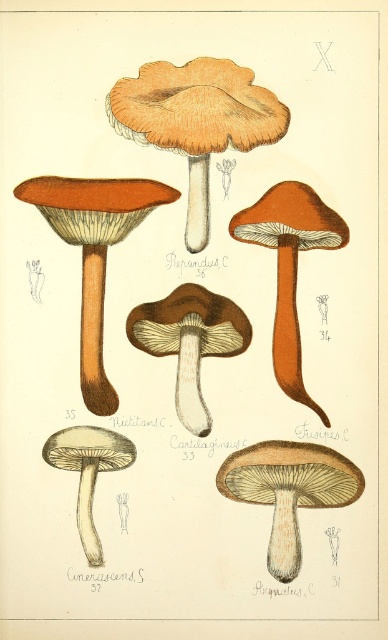
Is matte orange mushroom at left above smooth beige mushroom at lower left?

Correct, matte orange mushroom at left is located above smooth beige mushroom at lower left.

Between point (131, 225) and point (91, 528), which one is positioned in front?

Point (91, 528)

Describe the element at coordinates (93, 252) in the screenshot. This screenshot has height=640, width=388. I see `matte orange mushroom at left` at that location.

At what (x,y) coordinates should I click in order to perform the action: click on matte orange mushroom at left. Please return your answer as a coordinate pair (x, y). Looking at the image, I should click on (93, 252).

Is matte orange mushroom at left to the left of smooth beige mushroom at center from the viewer's perspective?

Yes, matte orange mushroom at left is to the left of smooth beige mushroom at center.

Describe the element at coordinates (93, 252) in the screenshot. I see `matte orange mushroom at left` at that location.

I want to click on matte orange mushroom at left, so click(93, 252).

Can you confirm if smooth beige mushroom at center is taller than matte brown mushroom at center?

No, smooth beige mushroom at center is not taller than matte brown mushroom at center.

In the scene shown: Does smooth beige mushroom at center lie behind matte brown mushroom at center?

No, smooth beige mushroom at center is closer to the viewer.

This screenshot has height=640, width=388. Describe the element at coordinates (289, 490) in the screenshot. I see `smooth beige mushroom at center` at that location.

At what (x,y) coordinates should I click in order to perform the action: click on smooth beige mushroom at center. Please return your answer as a coordinate pair (x, y). Looking at the image, I should click on (289, 490).